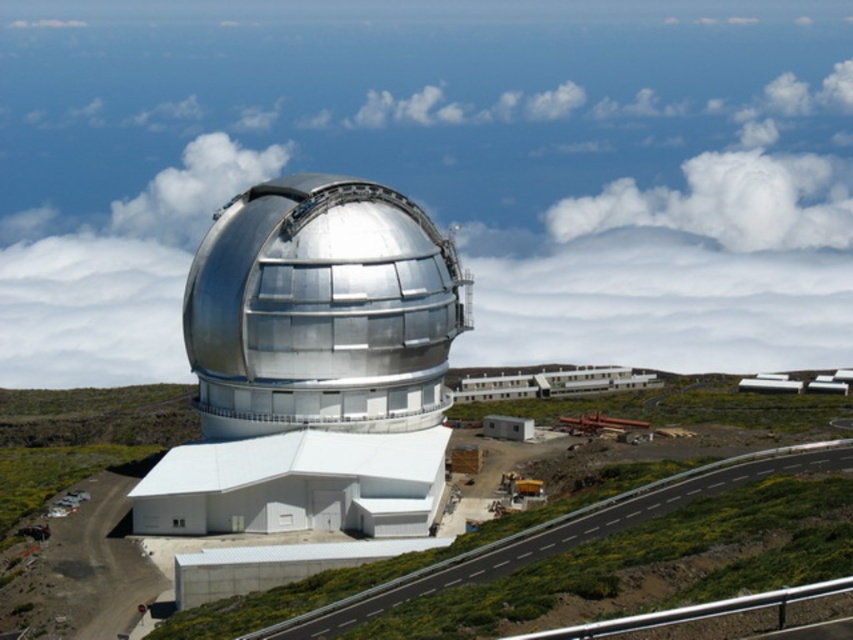
In the scene shown: You are planning to build a small weather station on the observatory hill. The weather station requires a clear view of the sky and must be placed where it won not be obstructed by the metallic silver dome at center or the white fluffy cloud at upper center. Based on the scene, where should you position it?

The metallic silver dome at center is much taller than the white fluffy cloud at upper center. To avoid obstruction from the dome, the weather station should be placed on the lower part of the hill, below the dome, where the cloud is not blocking the sky.

You are an astronomer planning to visit the observatory. You see the metallic silver dome at center and the polished silver observatory at center. Which object is closer to you as you approach the hilltop?

The metallic silver dome at center is closer to you than the polished silver observatory at center as you approach the hilltop.

You are a delivery driver approaching the observatory and need to park your vehicle. The parking lot is located near the polished silver observatory at center. Which direction should you drive relative to the metallic silver dome at center to reach the parking area?

The metallic silver dome at center is positioned on the right side of polished silver observatory at center. To reach the parking area near the polished silver observatory at center, you should drive to the left of the metallic silver dome at center since the observatory is to the left of the dome.